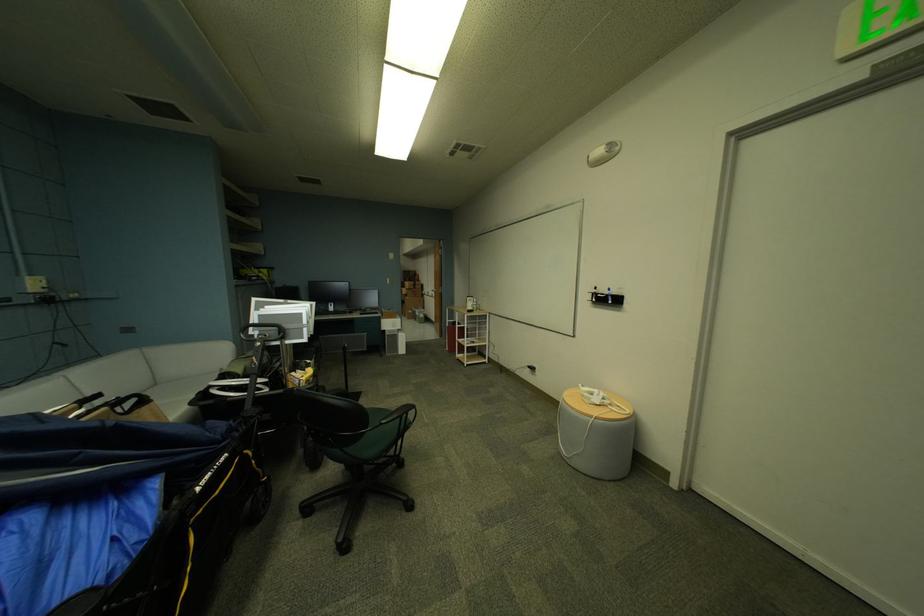
The width and height of the screenshot is (924, 616). Identify the location of grey sofa sitting surface. (177, 389).